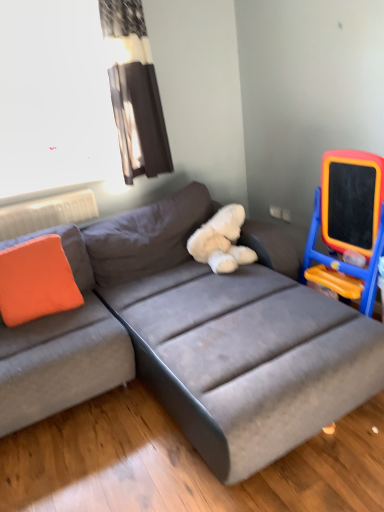
Question: From the image's perspective, is black fabric curtain at upper left above gray fabric couch at center?

Choices:
 (A) yes
 (B) no

Answer: (A)

Question: Is black fabric curtain at upper left oriented away from gray fabric couch at center?

Choices:
 (A) no
 (B) yes

Answer: (A)

Question: Is black fabric curtain at upper left in front of gray fabric couch at center?

Choices:
 (A) no
 (B) yes

Answer: (A)

Question: From a real-world perspective, is black fabric curtain at upper left over gray fabric couch at center?

Choices:
 (A) no
 (B) yes

Answer: (B)

Question: Does black fabric curtain at upper left have a lesser height compared to gray fabric couch at center?

Choices:
 (A) yes
 (B) no

Answer: (B)

Question: From a real-world perspective, is transparent plastic window screen at upper left physically located above or below gray fabric couch at center?

Choices:
 (A) above
 (B) below

Answer: (A)

Question: Is transparent plastic window screen at upper left taller or shorter than gray fabric couch at center?

Choices:
 (A) short
 (B) tall

Answer: (B)

Question: In the image, is transparent plastic window screen at upper left on the left side or the right side of gray fabric couch at center?

Choices:
 (A) left
 (B) right

Answer: (A)

Question: Relative to gray fabric couch at center, is transparent plastic window screen at upper left in front or behind?

Choices:
 (A) behind
 (B) front

Answer: (A)

Question: From their relative heights in the image, would you say transparent plastic window screen at upper left is taller or shorter than orange fabric pillow at left?

Choices:
 (A) tall
 (B) short

Answer: (A)

Question: Considering the relative positions of transparent plastic window screen at upper left and orange fabric pillow at left in the image provided, is transparent plastic window screen at upper left to the left or to the right of orange fabric pillow at left?

Choices:
 (A) right
 (B) left

Answer: (B)

Question: Based on their sizes in the image, would you say transparent plastic window screen at upper left is bigger or smaller than orange fabric pillow at left?

Choices:
 (A) small
 (B) big

Answer: (B)

Question: From the image's perspective, is transparent plastic window screen at upper left located above or below orange fabric pillow at left?

Choices:
 (A) above
 (B) below

Answer: (A)

Question: Looking at the image, does black fabric curtain at upper left seem bigger or smaller compared to orange fabric pillow at left?

Choices:
 (A) big
 (B) small

Answer: (A)

Question: Looking at their shapes, would you say black fabric curtain at upper left is wider or thinner than orange fabric pillow at left?

Choices:
 (A) wide
 (B) thin

Answer: (A)